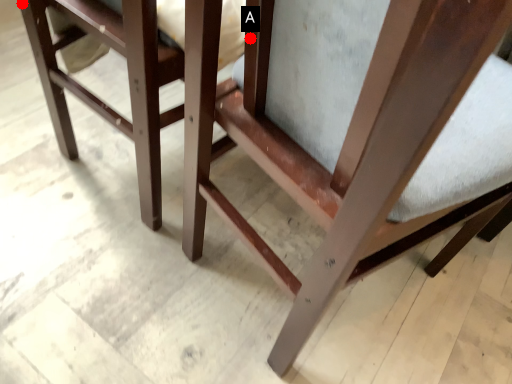
Question: Two points are circled on the image, labeled by A and B beside each circle. Which of the following is the closest to the observer?

Choices:
 (A) A is closer
 (B) B is closer

Answer: (A)